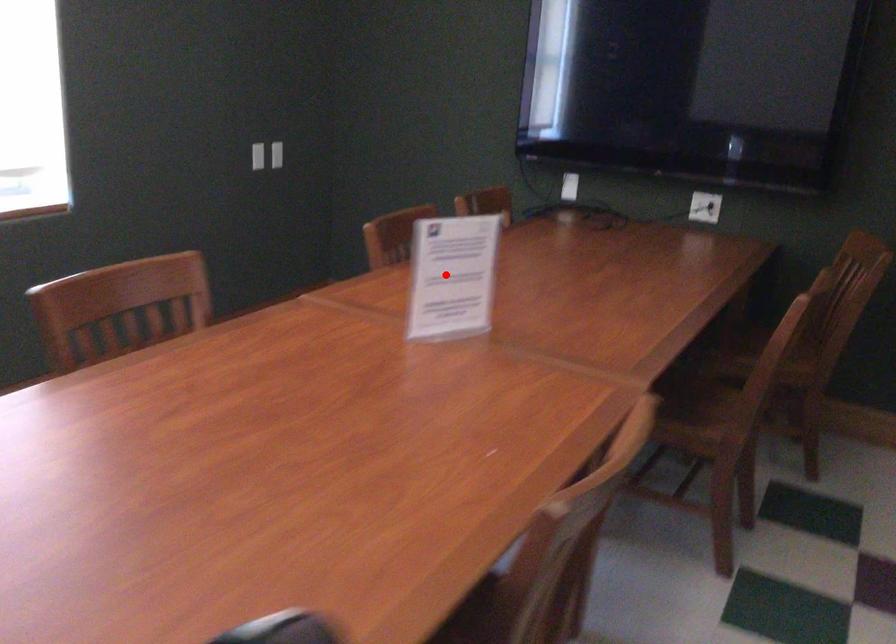
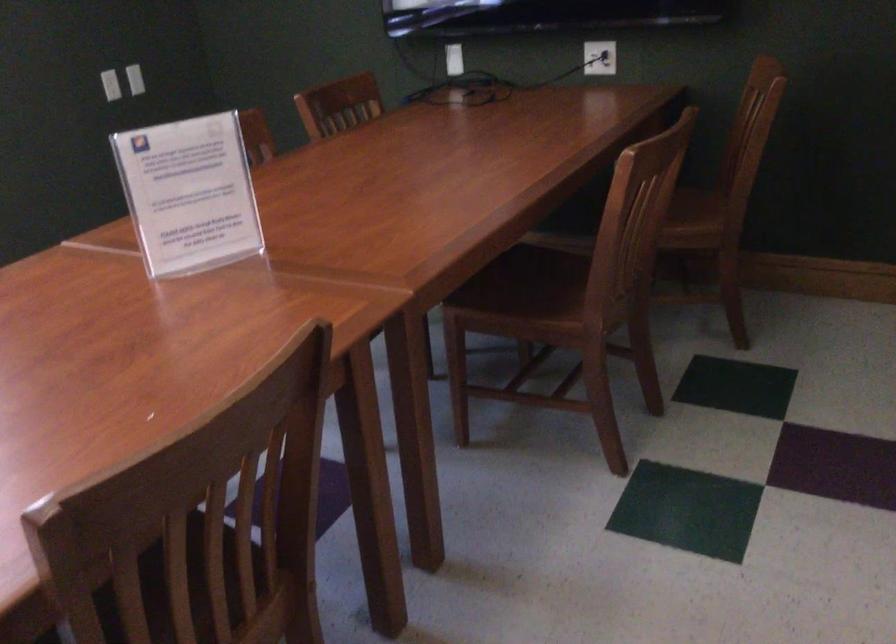
Question: A red point is marked in image1. In image2, is the corresponding 3D point closer to the camera or farther? Reply with the corresponding letter.

Choices:
 (A) The corresponding 3D point is closer.
 (B) The corresponding 3D point is farther.

Answer: (A)